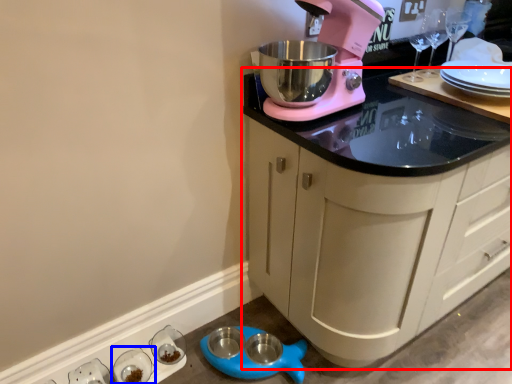
Question: Which of the following is the closest to the observer, cabinetry (highlighted by a red box) or tableware (highlighted by a blue box)?

Choices:
 (A) cabinetry
 (B) tableware

Answer: (A)